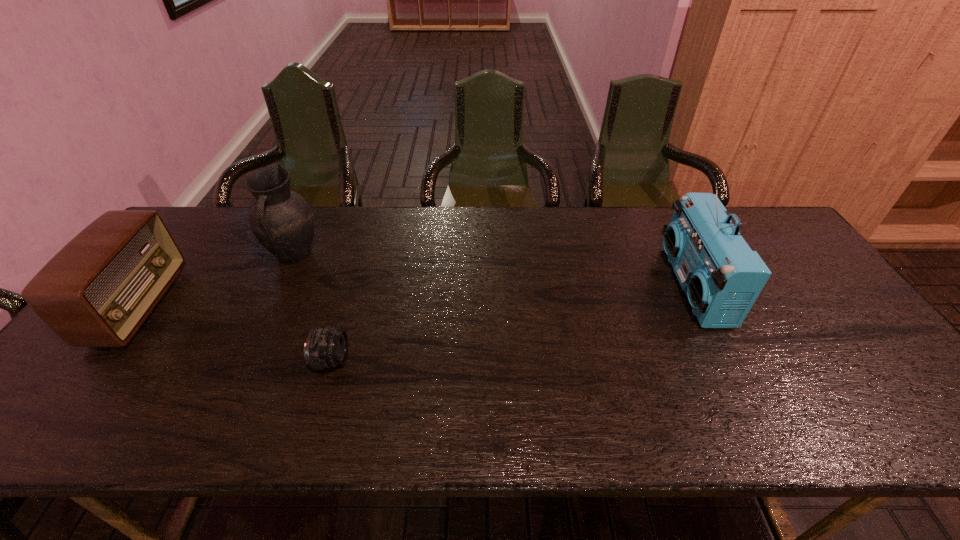
At what (x,y) coordinates should I click in order to perform the action: click on the taller radio receiver. Please return your answer as a coordinate pair (x, y). Looking at the image, I should click on pos(722,277).

The width and height of the screenshot is (960, 540). What are the coordinates of `the rightmost object` in the screenshot? It's located at (722, 277).

The image size is (960, 540). What are the coordinates of `pitcher` in the screenshot? It's located at (282, 220).

The image size is (960, 540). Find the location of `the second shortest object`. the second shortest object is located at coordinates (97, 291).

Identify the location of the leftmost object. (97, 291).

The image size is (960, 540). I want to click on telephoto lens, so click(x=326, y=347).

At what (x,y) coordinates should I click in order to perform the action: click on the third object from left to right. Please return your answer as a coordinate pair (x, y). Looking at the image, I should click on (326, 347).

Find the location of a particular element. free location located 0.400m on the front-facing side of the right radio receiver is located at coordinates [x=531, y=286].

The height and width of the screenshot is (540, 960). In order to click on vacant space located 0.280m on the front-facing side of the right radio receiver in this screenshot , I will do `click(573, 286)`.

This screenshot has width=960, height=540. Find the location of `free space located 0.090m on the front-facing side of the right radio receiver`. free space located 0.090m on the front-facing side of the right radio receiver is located at coordinates (640, 286).